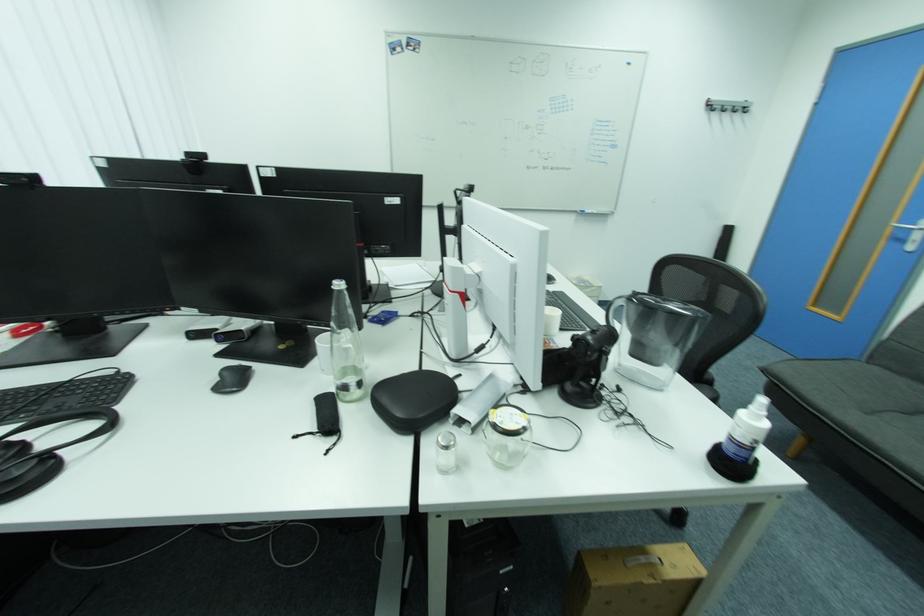
The width and height of the screenshot is (924, 616). Find the location of `clear glass bottle`. clear glass bottle is located at coordinates (345, 346).